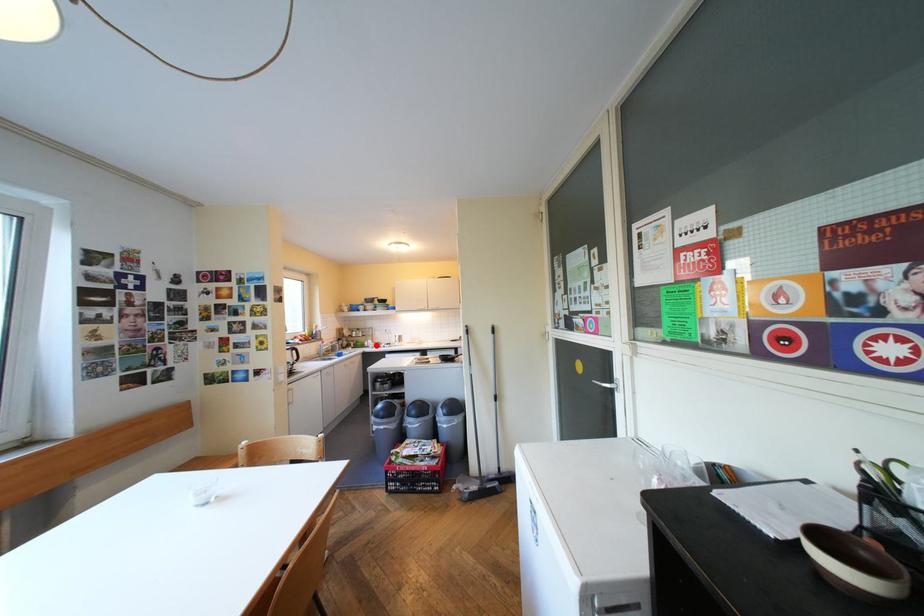
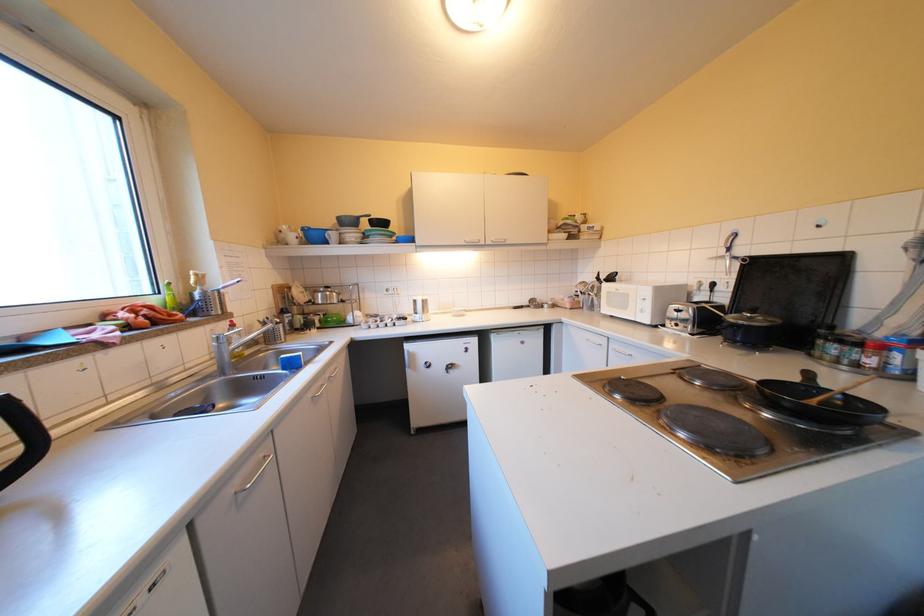
Where in the second image is the point corresponding to the highlighted location from the first image?

(356, 323)